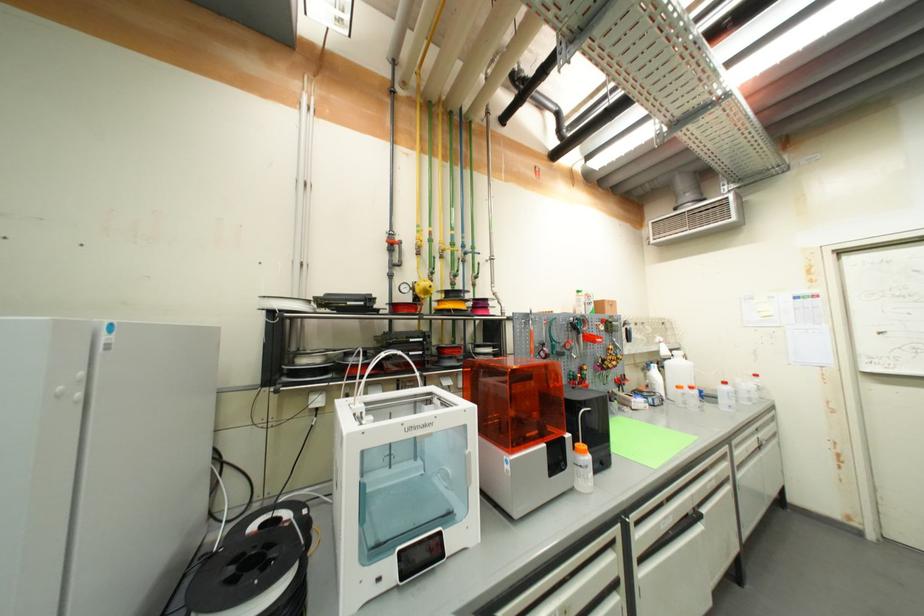
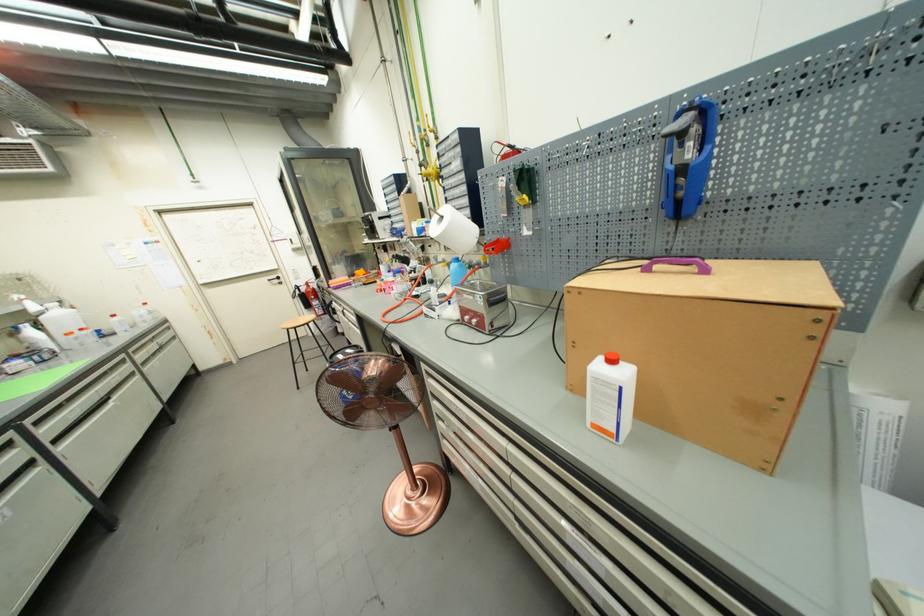
Locate, in the second image, the point that corresponds to point 743,464 in the first image.

(146, 363)